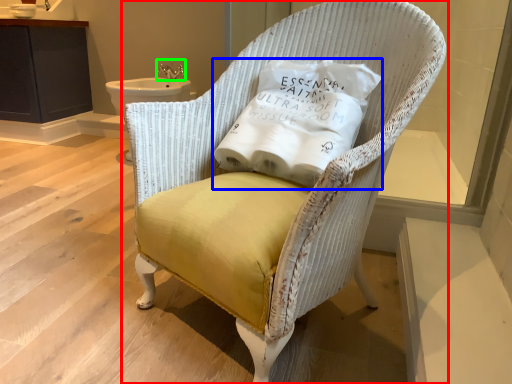
Question: Estimate the real-world distances between objects in this image. Which object is closer to chair (highlighted by a red box), pillow (highlighted by a blue box) or faucet (highlighted by a green box)?

Choices:
 (A) pillow
 (B) faucet

Answer: (A)